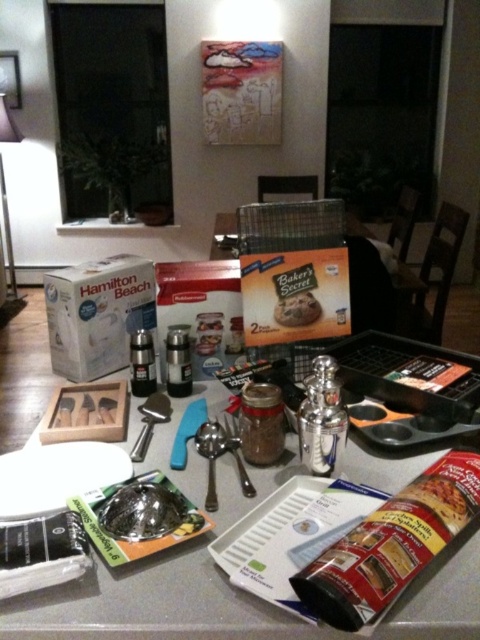
Who is more forward, (x=182, y=488) or (x=230, y=285)?

Point (x=182, y=488)

What do you see at coordinates (153, 605) in the screenshot? I see `metallic silver tray at center` at bounding box center [153, 605].

Where is `metallic silver tray at center`? The height and width of the screenshot is (640, 480). metallic silver tray at center is located at coordinates (153, 605).

Is metallic silver tray at center to the left of metallic spoon at center from the viewer's perspective?

Correct, you'll find metallic silver tray at center to the left of metallic spoon at center.

Is metallic silver tray at center thinner than metallic spoon at center?

No.

Describe the element at coordinates (153, 605) in the screenshot. I see `metallic silver tray at center` at that location.

Identify the location of metallic silver tray at center. (153, 605).

Which is in front, point (212, 570) or point (149, 417)?

Point (212, 570)

Is metallic silver tray at center to the right of metallic silver spatula at center from the viewer's perspective?

No, metallic silver tray at center is not to the right of metallic silver spatula at center.

The image size is (480, 640). I want to click on metallic silver tray at center, so click(153, 605).